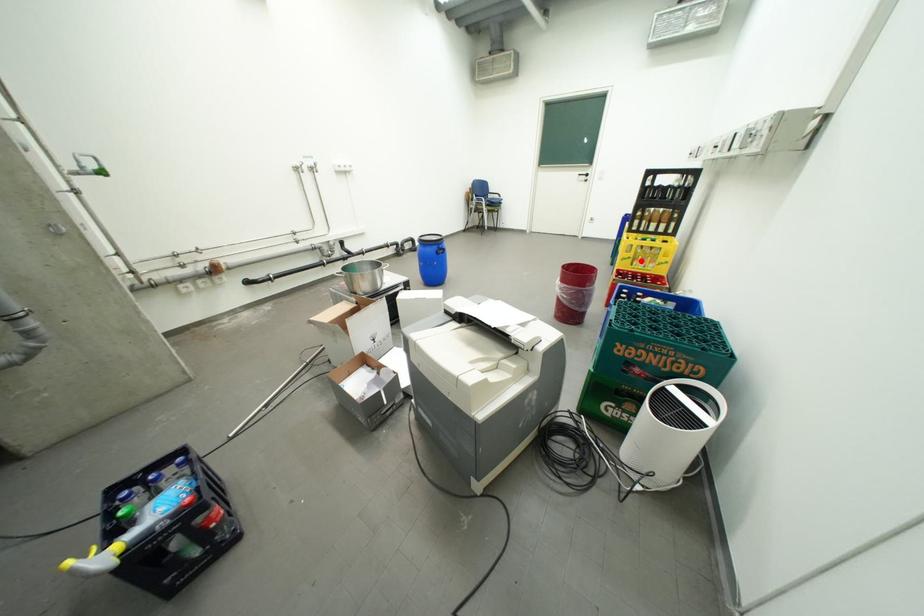
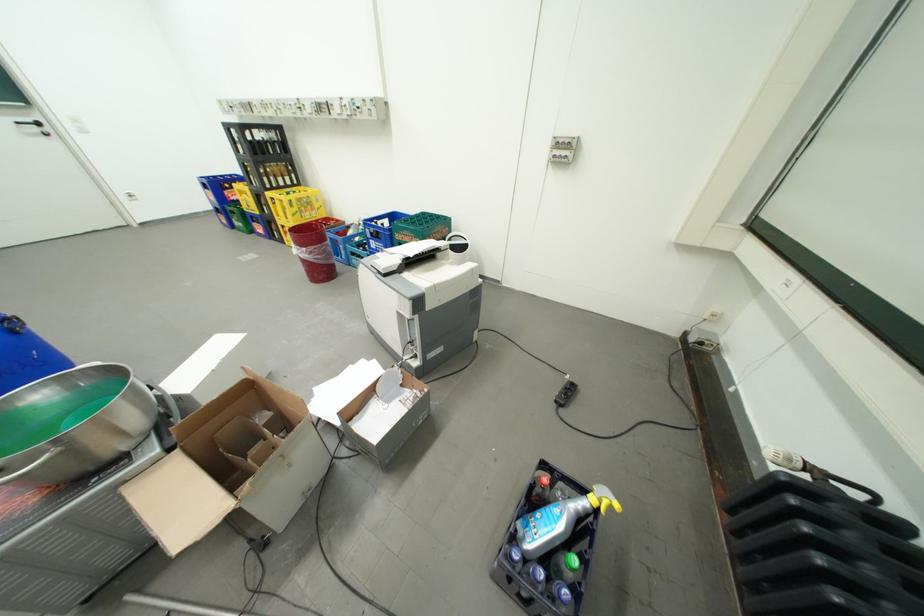
Question: I am providing you with two images of the same scene from different viewpoints. In image1, a red point is highlighted. Considering the same 3D point in image2, which of the following is correct?

Choices:
 (A) It is closer
 (B) It is farther

Answer: (B)